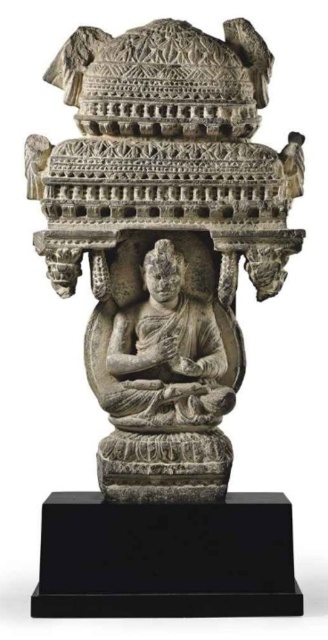
Question: Can you confirm if stone statue at center is positioned above gray stone buddha at center?

Choices:
 (A) yes
 (B) no

Answer: (A)

Question: Does stone statue at center appear over gray stone buddha at center?

Choices:
 (A) yes
 (B) no

Answer: (A)

Question: Which point is closer to the camera?

Choices:
 (A) stone statue at center
 (B) gray stone buddha at center

Answer: (A)

Question: Which object appears farthest from the camera in this image?

Choices:
 (A) stone statue at center
 (B) gray stone buddha at center

Answer: (B)

Question: Does stone statue at center lie behind gray stone buddha at center?

Choices:
 (A) no
 (B) yes

Answer: (A)